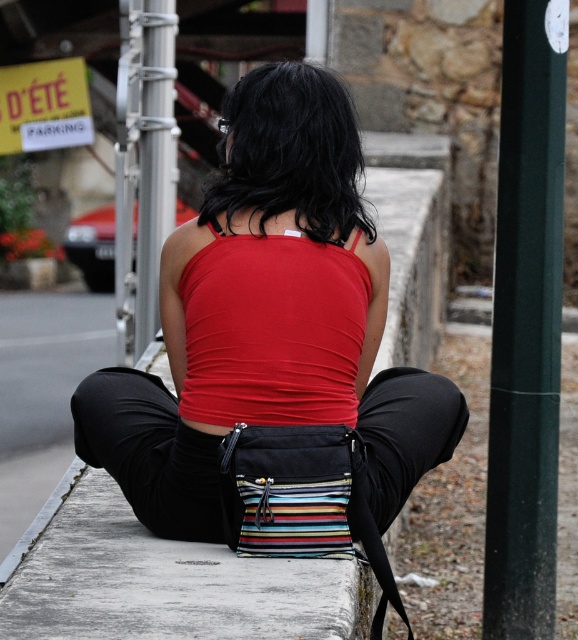
Consider the image. You are a fashion designer observing the person in the image. You notice both the matte black tank top at center and the red matte tank top at center. Which one is bigger in size?

The matte black tank top at center is larger in size than the red matte tank top at center.

You are a photographer trying to capture the red matte tank top at center and the green matte pole at right in the same frame. Based on their positions, which object should you adjust your camera to focus on first to ensure both are in the frame?

The green matte pole at right is positioned on the right side of the red matte tank top at center, so you should focus on the red matte tank top at center first to ensure both are included in the frame.